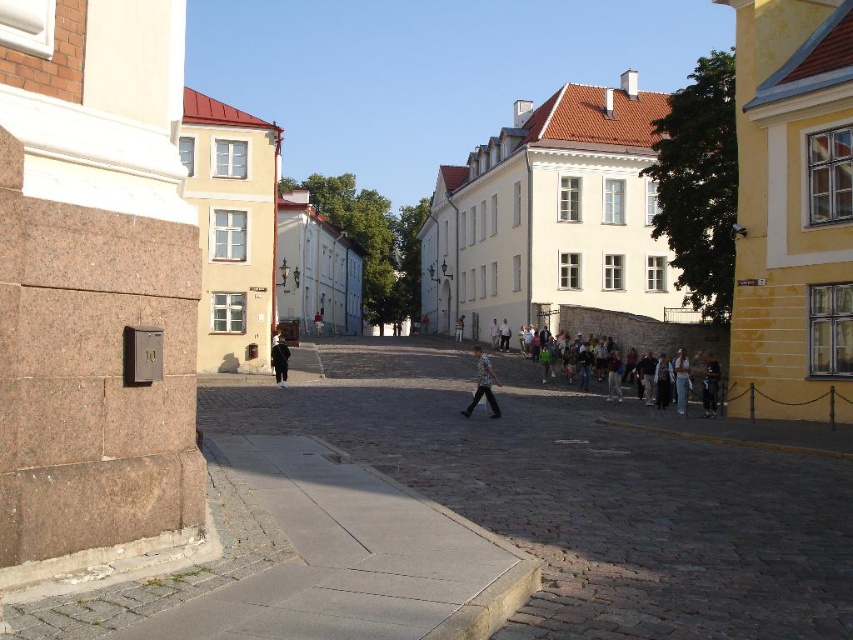
You are a photographer trying to capture both the striped shirt at center and the black matte jacket at center in a single frame. Since you want to ensure both are visible, which clothing item should you focus on first to avoid cropping the taller one out?

The black matte jacket at center is taller than the striped shirt at center, so you should focus on the black matte jacket at center first to ensure it fits within the frame.

You are standing on the cobblestone street and want to find the striped shirt at center. According to the coordinates provided, where should you look relative to the stone wall on the left?

The striped shirt at center is located at coordinates point [483,385], which means it is positioned to the right of the stone wall on the left, closer to the center of the street.